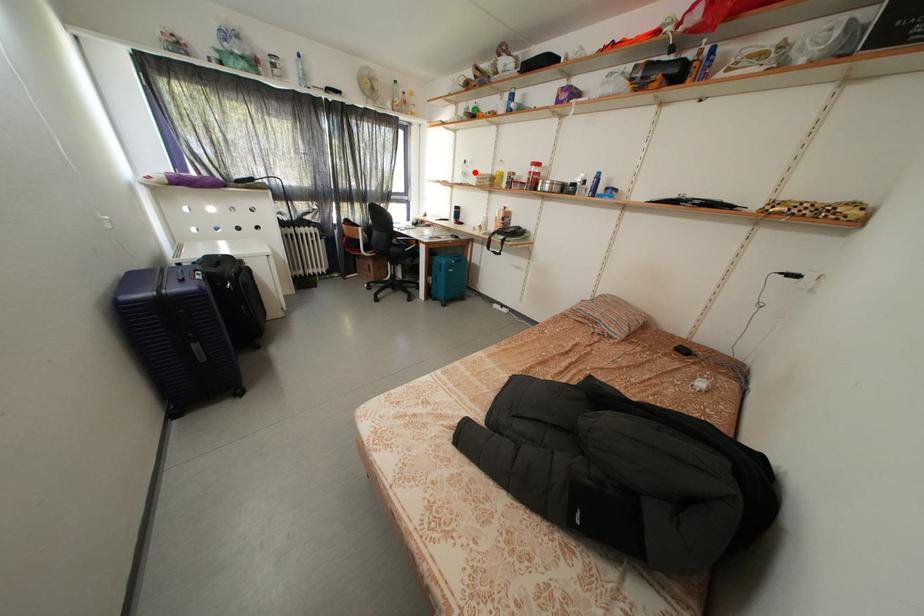
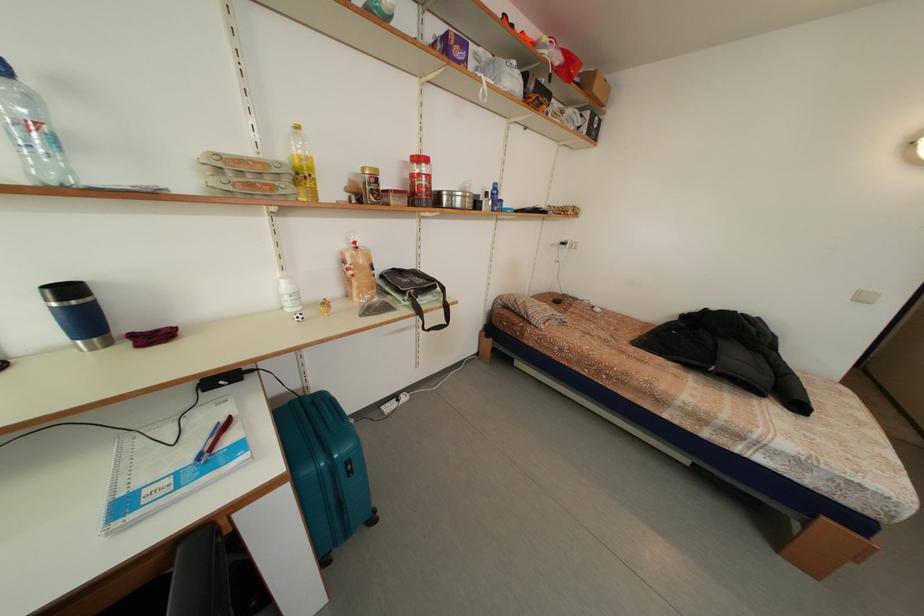
Question: I am providing you with two images of the same scene from different viewpoints. In image1, a red point is highlighted. Considering the same 3D point in image2, which of the following is correct?

Choices:
 (A) It is closer
 (B) It is farther

Answer: (B)